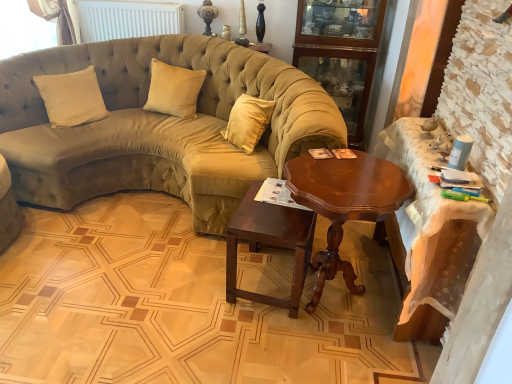
Question: Can you confirm if wooden table at right, the first table in the right-to-left sequence, is taller than velvet olive green couch at center?

Choices:
 (A) yes
 (B) no

Answer: (B)

Question: Could you tell me if wooden table at right, arranged as the 2th table when viewed from the left, is turned towards velvet olive green couch at center?

Choices:
 (A) no
 (B) yes

Answer: (B)

Question: Is wooden table at right, the first table in the right-to-left sequence, bigger than velvet olive green couch at center?

Choices:
 (A) yes
 (B) no

Answer: (B)

Question: Considering the relative sizes of wooden table at right, the first table in the right-to-left sequence, and velvet olive green couch at center in the image provided, is wooden table at right, the first table in the right-to-left sequence, thinner than velvet olive green couch at center?

Choices:
 (A) yes
 (B) no

Answer: (A)

Question: From the image's perspective, would you say wooden table at right, the first table in the right-to-left sequence, is positioned over velvet olive green couch at center?

Choices:
 (A) no
 (B) yes

Answer: (A)

Question: Considering the relative positions of wooden table at right, arranged as the 2th table when viewed from the left, and velvet olive green couch at center in the image provided, is wooden table at right, arranged as the 2th table when viewed from the left, in front of velvet olive green couch at center?

Choices:
 (A) yes
 (B) no

Answer: (A)

Question: From a real-world perspective, is velvet olive green couch at center physically below wooden cabinet at upper right?

Choices:
 (A) yes
 (B) no

Answer: (A)

Question: Does velvet olive green couch at center lie in front of wooden cabinet at upper right?

Choices:
 (A) no
 (B) yes

Answer: (B)

Question: Considering the relative sizes of velvet olive green couch at center and wooden cabinet at upper right in the image provided, is velvet olive green couch at center bigger than wooden cabinet at upper right?

Choices:
 (A) yes
 (B) no

Answer: (A)

Question: Is velvet olive green couch at center thinner than wooden cabinet at upper right?

Choices:
 (A) yes
 (B) no

Answer: (B)

Question: Would you say velvet olive green couch at center contains wooden cabinet at upper right?

Choices:
 (A) yes
 (B) no

Answer: (B)

Question: Is velvet olive green couch at center placed right next to wooden cabinet at upper right?

Choices:
 (A) no
 (B) yes

Answer: (A)

Question: Is wooden table at right, arranged as the 2th table when viewed from the left, surrounded by shiny brown wood coffee table at center?

Choices:
 (A) yes
 (B) no

Answer: (B)